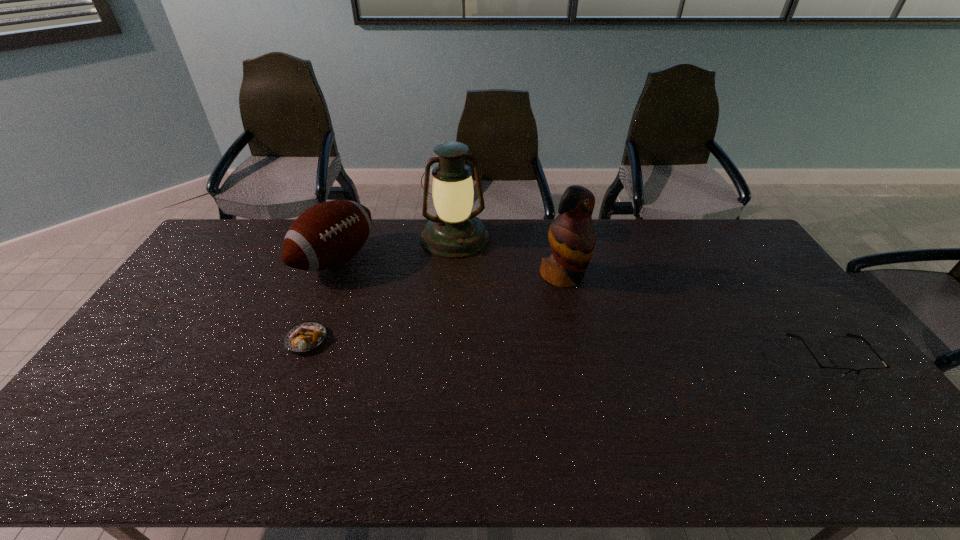
Identify the location of pastry. (306, 336).

What are the coordinates of `the rightmost object` in the screenshot? It's located at (827, 372).

Where is `the third shortest object`? The width and height of the screenshot is (960, 540). the third shortest object is located at coordinates (328, 234).

I want to click on the fourth object from left to right, so click(x=572, y=237).

The width and height of the screenshot is (960, 540). In order to click on the third object from right to left in this screenshot , I will do `click(455, 232)`.

Locate an element on the screen. The height and width of the screenshot is (540, 960). vacant space located on the right of the pastry is located at coordinates (386, 340).

In order to click on free space located on the laces of the third shortest object in this screenshot , I will do `click(381, 287)`.

The width and height of the screenshot is (960, 540). I want to click on free space located on the laces of the third shortest object, so click(x=404, y=300).

Locate an element on the screen. This screenshot has width=960, height=540. free space located 0.360m on the laces of the third shortest object is located at coordinates (444, 321).

This screenshot has width=960, height=540. In order to click on vacant area situated 0.230m on the face of the second object from right to left in this screenshot , I will do `click(623, 338)`.